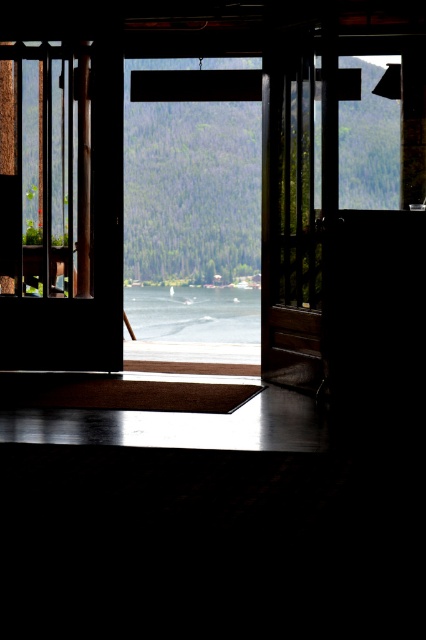
Question: Which point appears closest to the camera in this image?

Choices:
 (A) (54, 125)
 (B) (172, 269)

Answer: (A)

Question: Does transparent glass window at center appear under clear water at center?

Choices:
 (A) yes
 (B) no

Answer: (B)

Question: Does transparent glass door at left come behind wooden door at center?

Choices:
 (A) yes
 (B) no

Answer: (A)

Question: Among these points, which one is nearest to the camera?

Choices:
 (A) (291, 176)
 (B) (31, 99)
 (C) (195, 314)

Answer: (A)

Question: Can you confirm if transparent glass door at left is positioned above transparent glass window at center?

Choices:
 (A) no
 (B) yes

Answer: (A)

Question: Which point is farther to the camera?

Choices:
 (A) wooden door at center
 (B) clear water at center
 (C) transparent glass window at center
 (D) transparent glass door at left

Answer: (B)